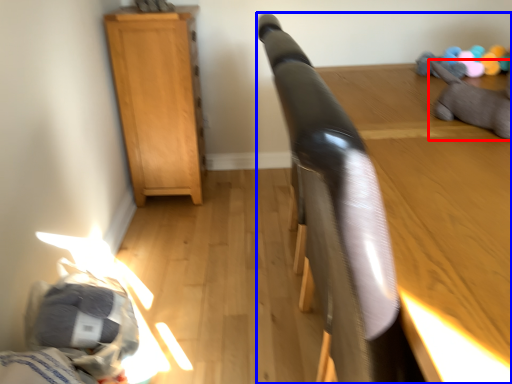
Question: Which point is further to the camera, animal (highlighted by a red box) or furniture (highlighted by a blue box)?

Choices:
 (A) animal
 (B) furniture

Answer: (A)